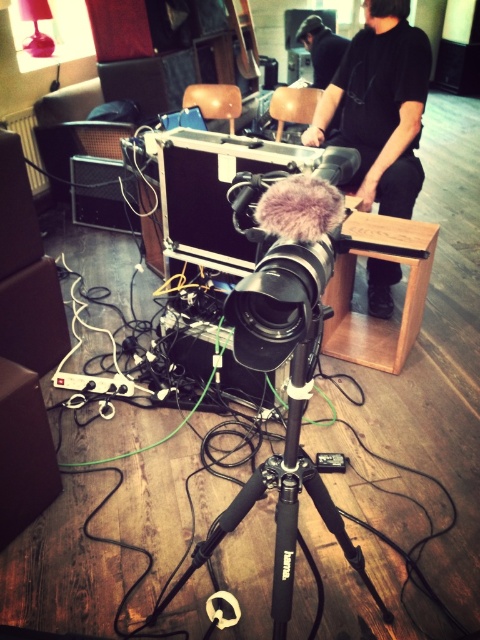
Question: Is black matte camera at center further to camera compared to black matte tripod at center?

Choices:
 (A) no
 (B) yes

Answer: (A)

Question: Which of these objects is positioned farthest from the black matte shirt at center?

Choices:
 (A) black fabric shirt at upper center
 (B) black matte tripod at center
 (C) black matte camera at center

Answer: (A)

Question: Is black matte shirt at center to the left of black matte tripod at center from the viewer's perspective?

Choices:
 (A) yes
 (B) no

Answer: (B)

Question: Which is nearer to the black matte tripod at center?

Choices:
 (A) black fabric shirt at upper center
 (B) black matte shirt at center

Answer: (B)

Question: Which point is closer to the camera?

Choices:
 (A) black fabric shirt at upper center
 (B) black matte shirt at center

Answer: (B)

Question: Is black matte camera at center bigger than black fabric shirt at upper center?

Choices:
 (A) yes
 (B) no

Answer: (B)